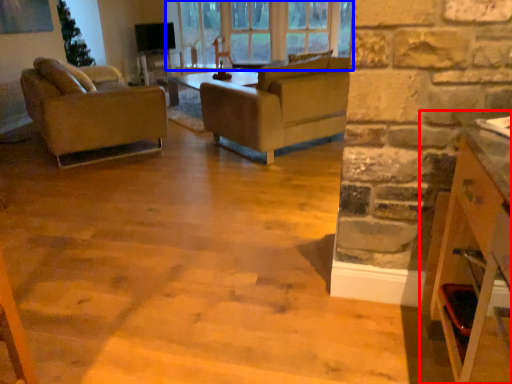
Question: Which object appears closest to the camera in this image, cabinetry (highlighted by a red box) or window (highlighted by a blue box)?

Choices:
 (A) cabinetry
 (B) window

Answer: (A)